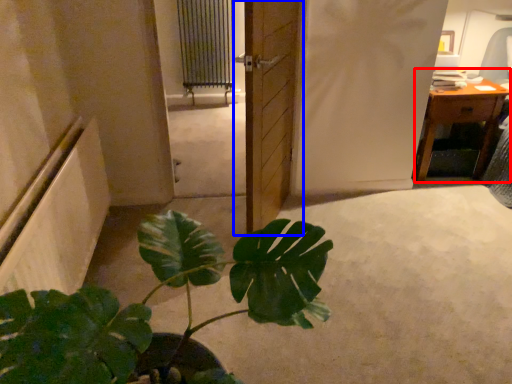
Question: Which object is further to the camera taking this photo, table (highlighted by a red box) or door (highlighted by a blue box)?

Choices:
 (A) table
 (B) door

Answer: (A)